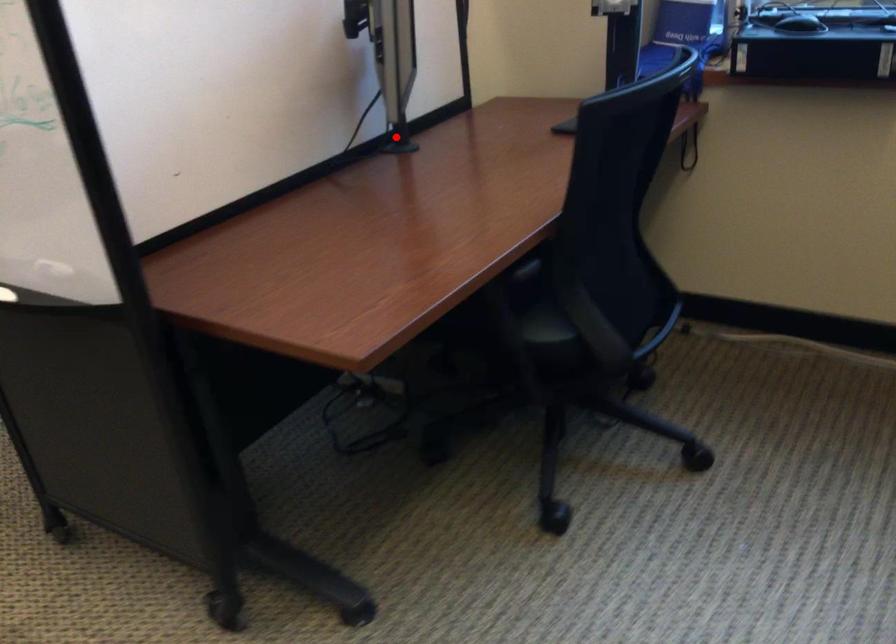
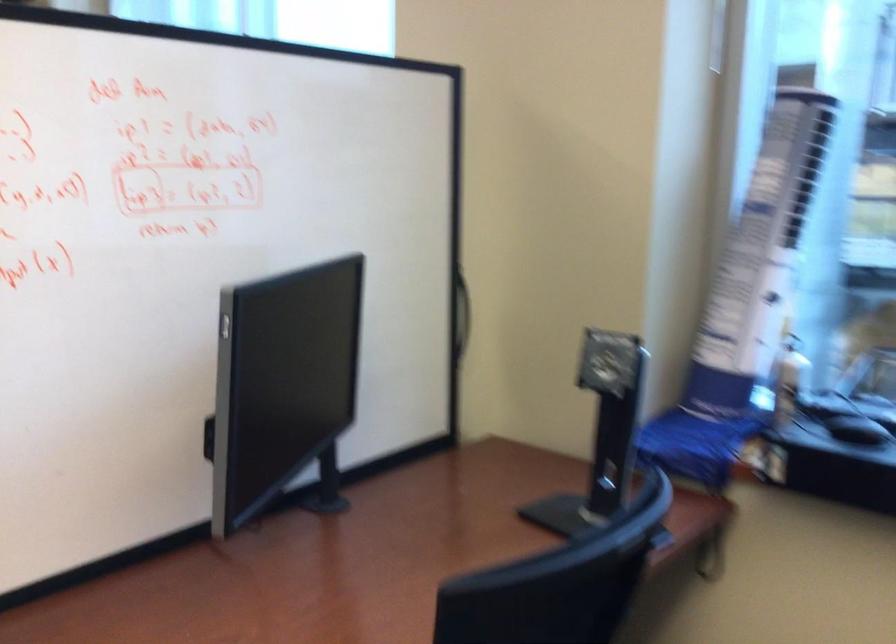
Question: I am providing you with two images of the same scene from different viewpoints. Given a red point in image1, look at the same physical point in image2. Is it:

Choices:
 (A) Closer to the viewpoint
 (B) Farther from the viewpoint

Answer: (A)